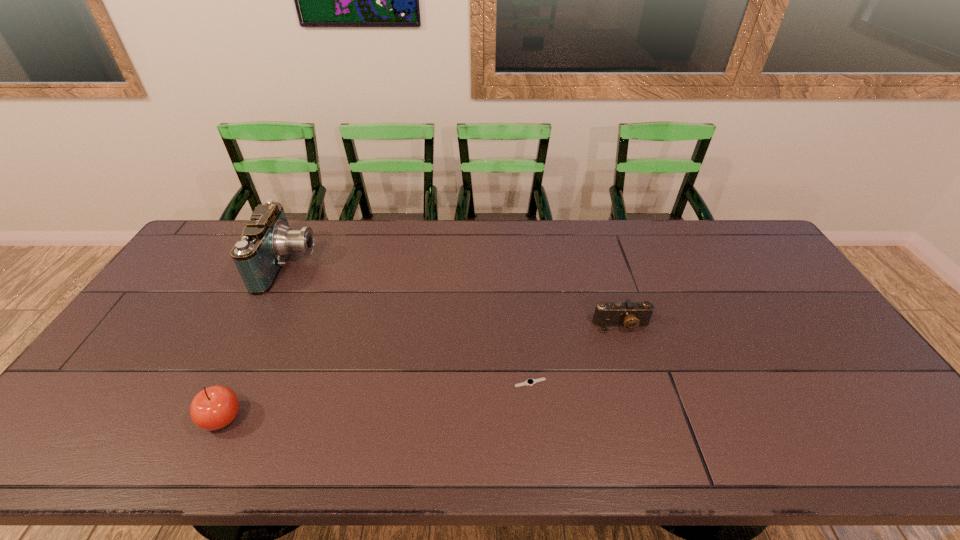
The width and height of the screenshot is (960, 540). Find the location of `free location located 0.200m on the front-facing side of the camera`. free location located 0.200m on the front-facing side of the camera is located at coordinates (643, 395).

This screenshot has width=960, height=540. Find the location of `vacant position located 0.220m on the right of the third object from left to right`. vacant position located 0.220m on the right of the third object from left to right is located at coordinates (632, 383).

Where is `object at the far edge`? object at the far edge is located at coordinates (260, 253).

Locate an element on the screen. object present at the near edge is located at coordinates (215, 407).

Image resolution: width=960 pixels, height=540 pixels. In the image, there is a desktop. In order to click on free space at the far edge in this screenshot , I will do `click(357, 224)`.

This screenshot has height=540, width=960. In order to click on free spot at the near edge of the desktop in this screenshot , I will do `click(337, 457)`.

Where is `blank space at the far right corner`? blank space at the far right corner is located at coordinates (768, 255).

At what (x,y) coordinates should I click in order to perform the action: click on vacant space at the near right corner of the desktop. Please return your answer as a coordinate pair (x, y). The image size is (960, 540). Looking at the image, I should click on pos(874,432).

The image size is (960, 540). In order to click on vacant space that is in between the camcorder and the rightmost object in this screenshot , I will do `click(455, 295)`.

Identify the location of unoccupied area between the second tallest object and the third nearest object. (422, 372).